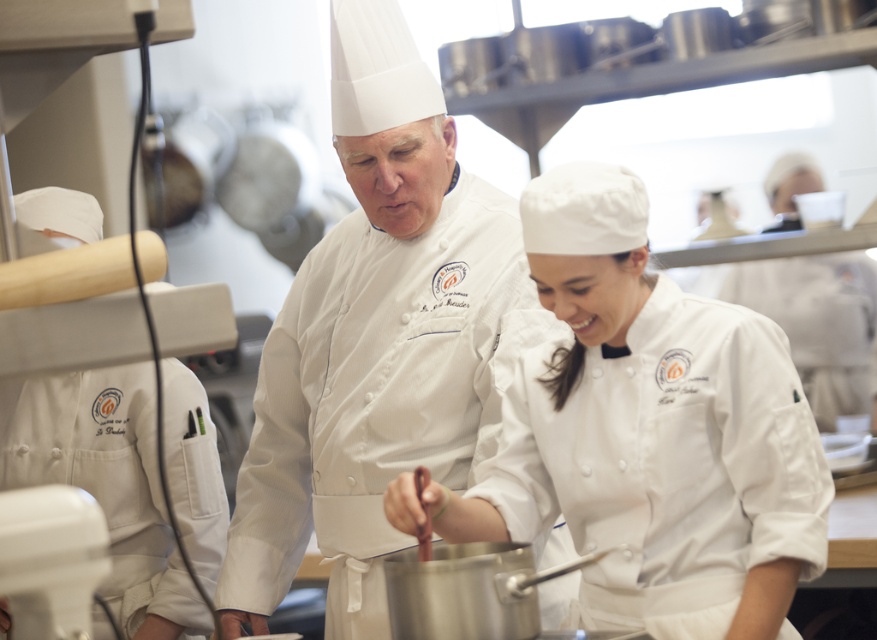
Question: Can you confirm if white matte chef coat at center is positioned to the right of white matte uniform at center?

Choices:
 (A) no
 (B) yes

Answer: (B)

Question: Which point is closer to the camera taking this photo?

Choices:
 (A) (429, 556)
 (B) (472, 259)

Answer: (A)

Question: Which point appears farthest from the camera in this image?

Choices:
 (A) (537, 276)
 (B) (417, 468)

Answer: (A)

Question: Which point is farther from the camera taking this photo?

Choices:
 (A) (410, 492)
 (B) (482, 285)

Answer: (B)

Question: Can you confirm if white matte chef coat at center is positioned below wooden spoon at center?

Choices:
 (A) yes
 (B) no

Answer: (B)

Question: Where is white matte chef coat at center located in relation to wooden spoon at center in the image?

Choices:
 (A) left
 (B) right

Answer: (B)